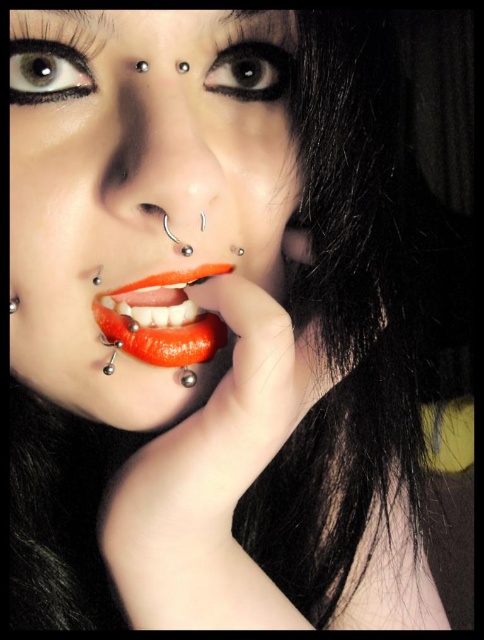
From the picture: You are a makeup artist trying to apply eyeliner between the black matte eyebrow at upper left and the brown matte eye at upper left. Given that your eyeliner pencil has a precision tip that can only make lines as thin as 0.3 inches, can you accurately apply the eyeliner in this space without overlapping?

The distance between the black matte eyebrow at upper left and the brown matte eye at upper left is 0.43 inches. Since the eyeliner pencil can make lines as thin as 0.3 inches, it is possible to apply the eyeliner without overlapping as the available space is wider than the minimum line width.

You are taking a photo with a camera that has a 14 inch focal length. You want to capture a close up portrait of the person in the scene. Is the distance between the camera and the point at coordinates point (74, 17) sufficient to achieve this?

The distance between the camera and point (74, 17) is 13.87 inches, which is slightly less than the camera focal length of 14 inches. This means the camera may not be able to focus properly on the point (74, 17), resulting in a blurred image. To achieve a clear close up, you should move the camera slightly further away to ensure the distance exceeds the focal length.